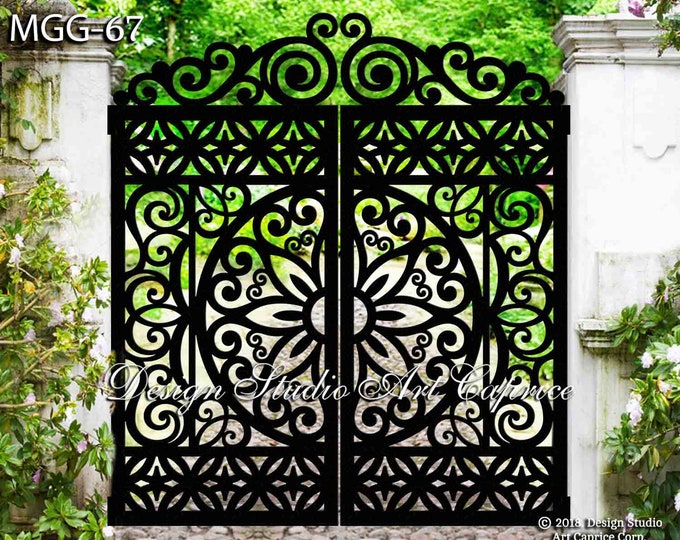
The width and height of the screenshot is (680, 540). Identify the location of wall. (96, 234), (617, 235).